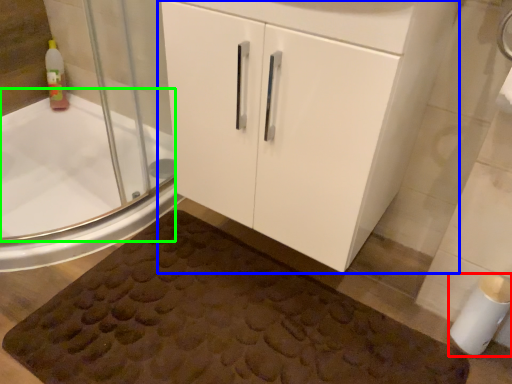
Question: Considering the real-world distances, which object is closest to toilet paper (highlighted by a red box)? bathroom cabinet (highlighted by a blue box) or bath (highlighted by a green box).

Choices:
 (A) bathroom cabinet
 (B) bath

Answer: (A)